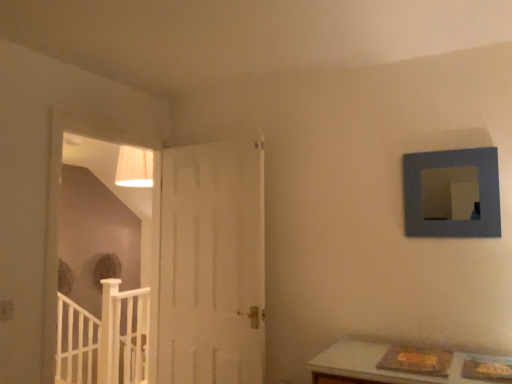
Question: Is white wood door at left inside the boundaries of blue matte picture frame at upper right, or outside?

Choices:
 (A) outside
 (B) inside

Answer: (A)

Question: In terms of width, does white wood door at left look wider or thinner when compared to blue matte picture frame at upper right?

Choices:
 (A) thin
 (B) wide

Answer: (B)

Question: Estimate the real-world distances between objects in this image. Which object is farther from the white wooden rail at lower left?

Choices:
 (A) blue matte picture frame at upper right
 (B) white wood door at left

Answer: (A)

Question: Estimate the real-world distances between objects in this image. Which object is closer to the white wood door at left?

Choices:
 (A) white wooden rail at lower left
 (B) blue matte picture frame at upper right

Answer: (A)